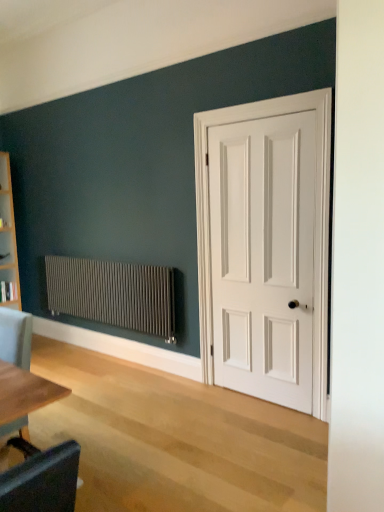
Question: In terms of width, does light gray fabric chair at lower left look wider or thinner when compared to white matte door at right?

Choices:
 (A) wide
 (B) thin

Answer: (A)

Question: Do you think light gray fabric chair at lower left is within white matte door at right, or outside of it?

Choices:
 (A) inside
 (B) outside

Answer: (B)

Question: Estimate the real-world distances between objects in this image. Which object is closer to the light gray fabric chair at lower left?

Choices:
 (A) white matte door at right
 (B) matte gray radiator at left

Answer: (B)

Question: Which is nearer to the white matte door at right?

Choices:
 (A) light gray fabric chair at lower left
 (B) matte gray radiator at left

Answer: (B)